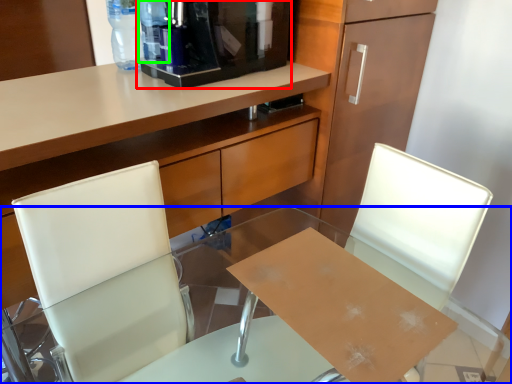
Question: Estimate the real-world distances between objects in this image. Which object is closer to coffee machine (highlighted by a red box), desk (highlighted by a blue box) or bottle (highlighted by a green box)?

Choices:
 (A) desk
 (B) bottle

Answer: (B)